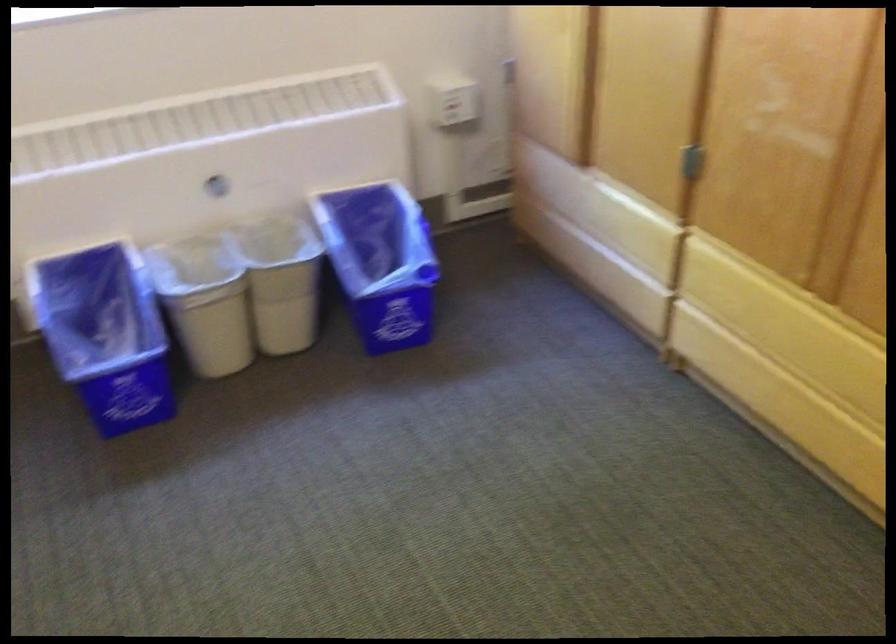
Describe the element at coordinates (218, 187) in the screenshot. The width and height of the screenshot is (896, 644). I see `the radiator dial` at that location.